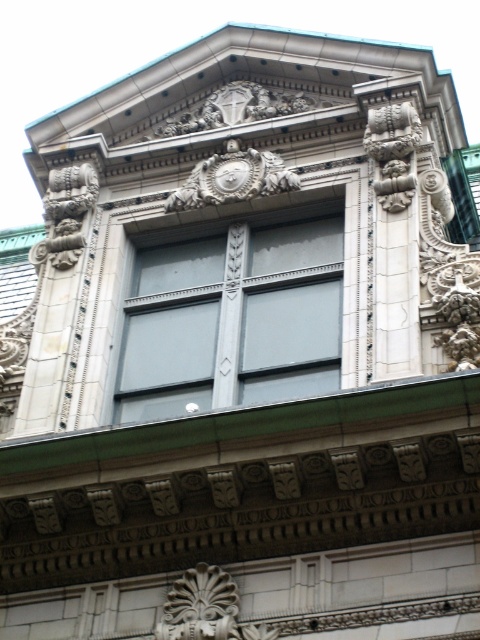
Does matte gray glass window at center appear on the left side of carved stone ornament at center?

Yes, matte gray glass window at center is to the left of carved stone ornament at center.

This screenshot has height=640, width=480. What do you see at coordinates (232, 317) in the screenshot?
I see `matte gray glass window at center` at bounding box center [232, 317].

Is point (283, 298) positioned after point (255, 636)?

Yes, it is.

You are a GUI agent. You are given a task and a screenshot of the screen. Output one action in this format:
    pyautogui.click(x=<x>, y=<y>)
    Task: Click on the matte gray glass window at center
    The height and width of the screenshot is (640, 480).
    Given the screenshot: What is the action you would take?
    pos(232,317)